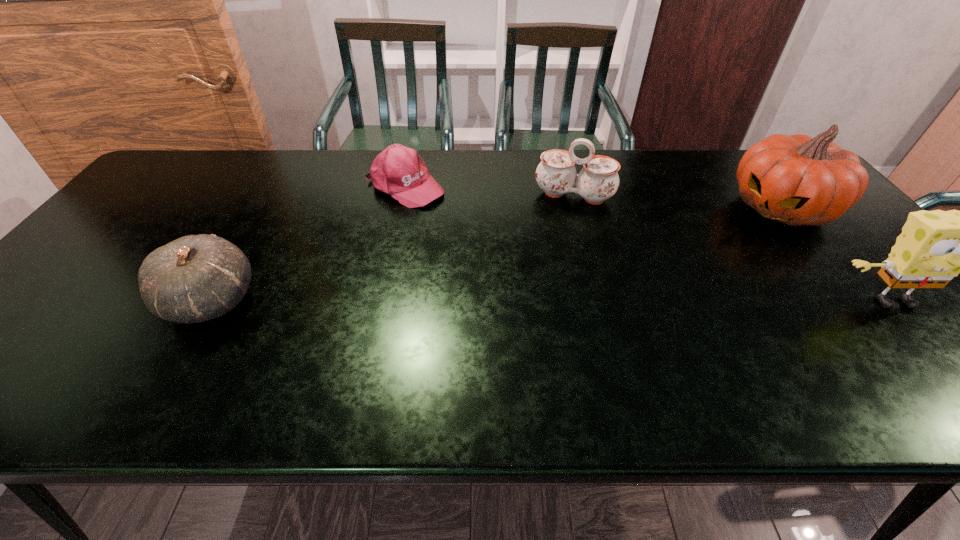
The height and width of the screenshot is (540, 960). What are the coordinates of `vacant spot on the desktop that is between the leftmost object and the sponge and is positioned on the face of the pumpkin` in the screenshot? It's located at (649, 301).

At what (x,y) coordinates should I click in order to perform the action: click on free space on the desktop that is between the leftmost object and the sponge and is positioned by the handle of the third object from right to left. Please return your answer as a coordinate pair (x, y). Image resolution: width=960 pixels, height=540 pixels. Looking at the image, I should click on (546, 301).

Locate an element on the screen. This screenshot has width=960, height=540. free space on the desktop that is between the leftmost object and the sponge and is positioned at the front of the baseball cap with the brim is located at coordinates (594, 301).